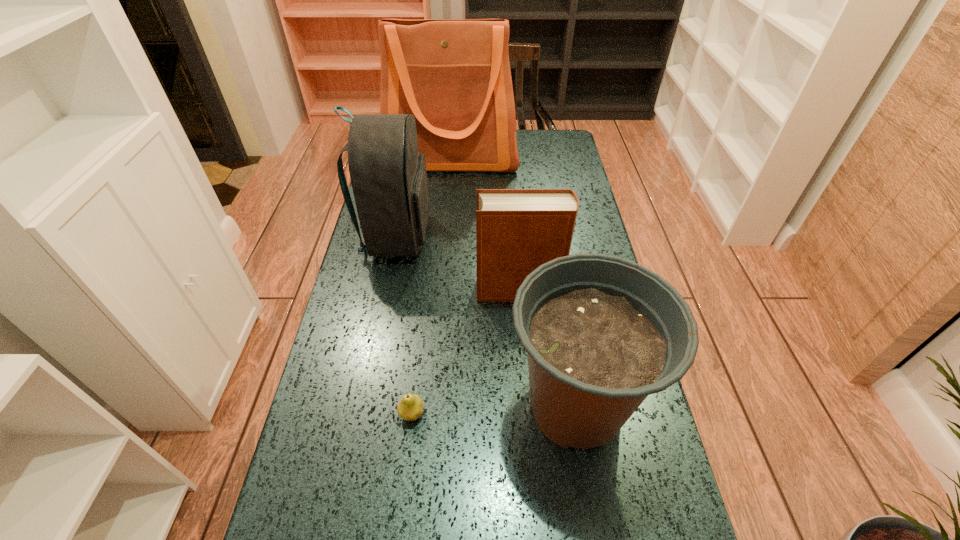
Identify the location of the farthest object. Image resolution: width=960 pixels, height=540 pixels. (453, 75).

Where is `the fourth nearest object`? This screenshot has height=540, width=960. the fourth nearest object is located at coordinates (388, 175).

The image size is (960, 540). What are the coordinates of `flowerpot` in the screenshot? It's located at point(602,333).

Identify the location of hardback book. This screenshot has height=540, width=960. (517, 230).

Locate an element on the screen. The height and width of the screenshot is (540, 960). pear is located at coordinates (410, 407).

The image size is (960, 540). I want to click on vacant space situated on the front pocket of the farthest object, so click(444, 249).

Image resolution: width=960 pixels, height=540 pixels. I want to click on free location located 0.190m on the front-facing side of the second farthest object, so click(x=490, y=236).

Locate an element on the screen. This screenshot has height=540, width=960. free space located on the back of the flowerpot is located at coordinates (551, 256).

Where is `blank space located 0.210m on the open cover of the hardback book`? The height and width of the screenshot is (540, 960). blank space located 0.210m on the open cover of the hardback book is located at coordinates (404, 290).

Where is `blank space located 0.320m on the open cover of the hardback book`? Image resolution: width=960 pixels, height=540 pixels. blank space located 0.320m on the open cover of the hardback book is located at coordinates (366, 290).